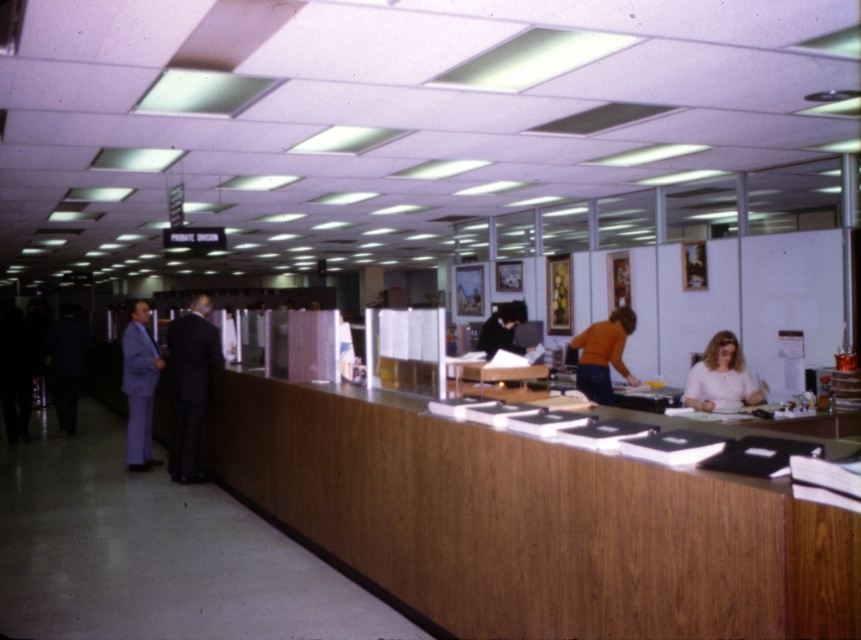
Which of these two, wooden counter at center or orange sweater at center, stands taller?

With more height is wooden counter at center.

Measure the distance between wooden counter at center and camera.

wooden counter at center is 1.99 meters away from camera.

At what (x,y) coordinates should I click in order to perform the action: click on wooden counter at center. Please return your answer as a coordinate pair (x, y). Image resolution: width=861 pixels, height=640 pixels. Looking at the image, I should click on pos(530,524).

Which is below, light purple suit at left or orange sweater at center?

light purple suit at left

Is point (147, 419) positioned before point (624, 369)?

No, it is behind (624, 369).

Is point (138, 445) positioned before point (580, 385)?

No, it is not.

I want to click on light purple suit at left, so click(139, 387).

Can you confirm if dark suit at center is smaller than light purple suit at left?

Incorrect, dark suit at center is not smaller in size than light purple suit at left.

Is dark suit at center to the left of light purple suit at left from the viewer's perspective?

In fact, dark suit at center is to the right of light purple suit at left.

Is point (197, 435) positioned behind point (131, 381)?

That is False.

You are a GUI agent. You are given a task and a screenshot of the screen. Output one action in this format:
    pyautogui.click(x=<x>, y=<y>)
    Task: Click on the dark suit at center
    
    Given the screenshot: What is the action you would take?
    pyautogui.click(x=189, y=385)